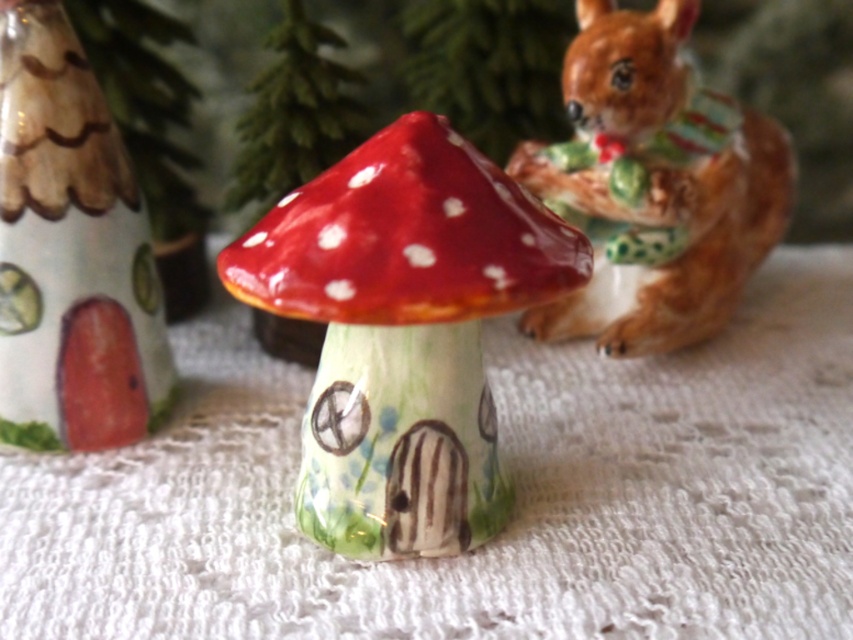
Question: Does glossy ceramic mushroom at center appear on the right side of brown glossy squirrel at upper right?

Choices:
 (A) yes
 (B) no

Answer: (B)

Question: Which point appears closest to the camera in this image?

Choices:
 (A) (436, 406)
 (B) (538, 516)
 (C) (616, 214)

Answer: (A)

Question: Which object is the farthest from the brown glossy squirrel at upper right?

Choices:
 (A) glossy ceramic mushroom at center
 (B) white lace tablecloth at center

Answer: (A)

Question: Based on their relative distances, which object is farther from the white lace tablecloth at center?

Choices:
 (A) glossy ceramic mushroom at center
 (B) brown glossy squirrel at upper right

Answer: (A)

Question: Does white lace tablecloth at center appear over brown glossy squirrel at upper right?

Choices:
 (A) yes
 (B) no

Answer: (B)

Question: Where is white lace tablecloth at center located in relation to brown glossy squirrel at upper right in the image?

Choices:
 (A) right
 (B) left

Answer: (B)